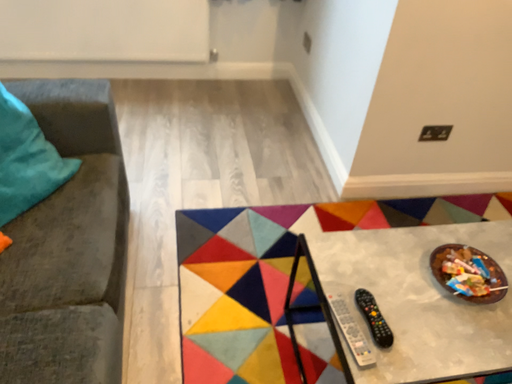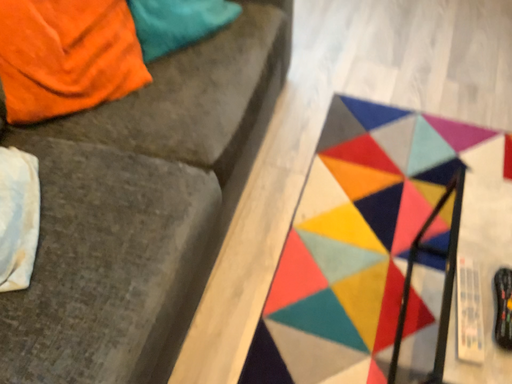
Question: Which way did the camera rotate in the video?

Choices:
 (A) rotated right
 (B) rotated left

Answer: (B)